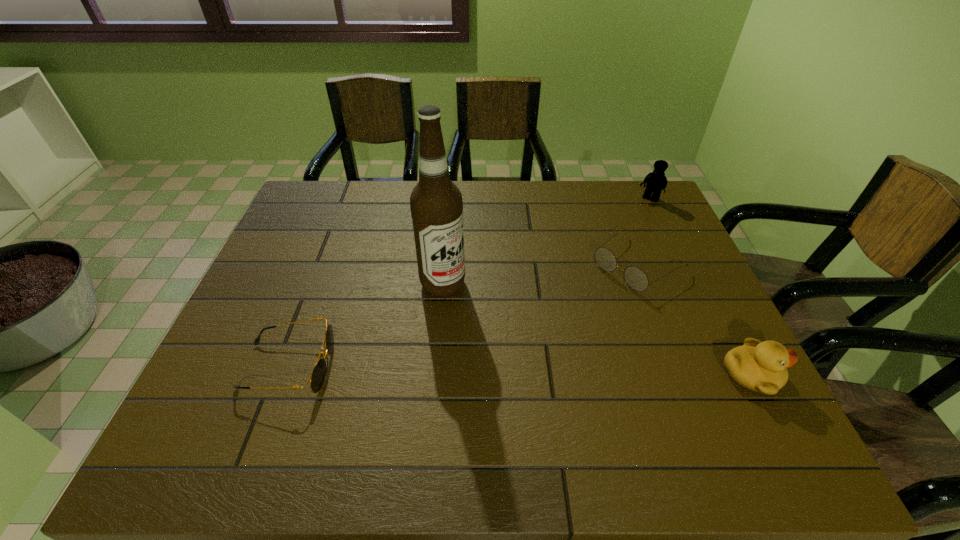
Identify the location of object present at the left edge. (317, 377).

Where is `duckling at the right edge`? The height and width of the screenshot is (540, 960). duckling at the right edge is located at coordinates (759, 366).

Find the location of `spectacles at the right edge`. spectacles at the right edge is located at coordinates (635, 277).

The image size is (960, 540). I want to click on Lego positioned at the right edge, so click(656, 181).

This screenshot has width=960, height=540. I want to click on object at the near left corner, so click(317, 377).

What are the coordinates of `object present at the far right corner` in the screenshot? It's located at (656, 181).

Identify the location of object that is at the near right corner. This screenshot has height=540, width=960. (759, 366).

Where is `vacant space at the far edge of the desktop`? vacant space at the far edge of the desktop is located at coordinates (355, 212).

Where is `vacant space at the right edge of the desktop`? This screenshot has height=540, width=960. vacant space at the right edge of the desktop is located at coordinates (655, 263).

Find the location of `blank space at the far right corner`. blank space at the far right corner is located at coordinates (644, 212).